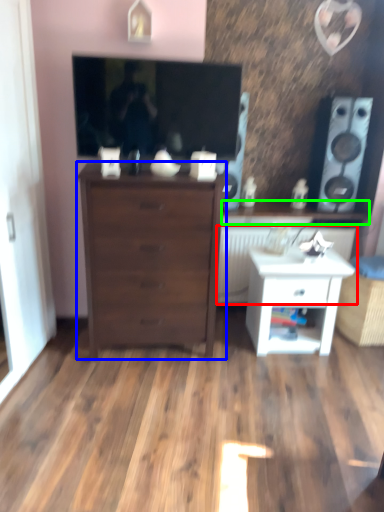
Question: Which is nearer to the radiator (highlighted by a red box)? chest of drawers (highlighted by a blue box) or counter top (highlighted by a green box).

Choices:
 (A) chest of drawers
 (B) counter top

Answer: (B)